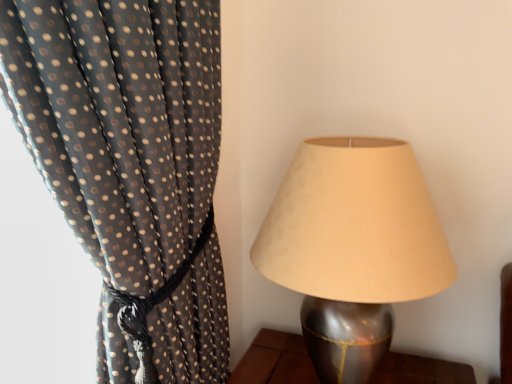
Find the location of `black sheer fabric with gold dots at left`. black sheer fabric with gold dots at left is located at coordinates (119, 134).

What do you see at coordinates (119, 134) in the screenshot? I see `black sheer fabric with gold dots at left` at bounding box center [119, 134].

Describe the element at coordinates (353, 247) in the screenshot. I see `metallic silver lampshade at right` at that location.

Locate an element on the screen. This screenshot has height=384, width=512. metallic silver lampshade at right is located at coordinates click(x=353, y=247).

Where is `black sheer fabric with gold dots at left`? black sheer fabric with gold dots at left is located at coordinates (119, 134).

Is black sheer fabric with gold dots at left to the right of metallic silver lampshade at right from the viewer's perspective?

Incorrect, black sheer fabric with gold dots at left is not on the right side of metallic silver lampshade at right.

Which object is closer to the camera, black sheer fabric with gold dots at left or metallic silver lampshade at right?

black sheer fabric with gold dots at left is more forward.

Looking at this image, which point is more forward, (67, 99) or (283, 262)?

The point (67, 99) is closer.

From the image's perspective, does black sheer fabric with gold dots at left appear higher than metallic silver lampshade at right?

Yes, from the image's perspective, black sheer fabric with gold dots at left is on top of metallic silver lampshade at right.

From a real-world perspective, is black sheer fabric with gold dots at left on metallic silver lampshade at right?

Indeed, from a real-world perspective, black sheer fabric with gold dots at left stands above metallic silver lampshade at right.

Based on the photo, which of these two, black sheer fabric with gold dots at left or metallic silver lampshade at right, is thinner?

metallic silver lampshade at right is thinner.

Which of these two, black sheer fabric with gold dots at left or metallic silver lampshade at right, stands taller?

Standing taller between the two is black sheer fabric with gold dots at left.

Which of these two, black sheer fabric with gold dots at left or metallic silver lampshade at right, is smaller?

metallic silver lampshade at right is smaller.

Which is correct: black sheer fabric with gold dots at left is inside metallic silver lampshade at right, or outside of it?

black sheer fabric with gold dots at left is located beyond the bounds of metallic silver lampshade at right.

Is black sheer fabric with gold dots at left not near metallic silver lampshade at right?

black sheer fabric with gold dots at left is near metallic silver lampshade at right, not far away.

Is black sheer fabric with gold dots at left looking in the opposite direction of metallic silver lampshade at right?

No, black sheer fabric with gold dots at left is not facing the opposite direction of metallic silver lampshade at right.

How different are the orientations of black sheer fabric with gold dots at left and metallic silver lampshade at right in degrees?

There is a 8.63e-05-degree angle between the facing directions of black sheer fabric with gold dots at left and metallic silver lampshade at right.

How much distance is there between black sheer fabric with gold dots at left and metallic silver lampshade at right?

They are 11.75 inches apart.

This screenshot has width=512, height=384. What are the coordinates of `lamp on the right of black sheer fabric with gold dots at left` in the screenshot? It's located at (353, 247).

Is metallic silver lampshade at right at the right side of black sheer fabric with gold dots at left?

Indeed, metallic silver lampshade at right is positioned on the right side of black sheer fabric with gold dots at left.

Which object is closer to the camera taking this photo, metallic silver lampshade at right or black sheer fabric with gold dots at left?

black sheer fabric with gold dots at left is in front.

Is point (297, 195) closer or farther from the camera than point (103, 161)?

Point (297, 195).

From the image's perspective, would you say metallic silver lampshade at right is positioned over black sheer fabric with gold dots at left?

Incorrect, from the image's perspective, metallic silver lampshade at right is lower than black sheer fabric with gold dots at left.

From a real-world perspective, who is located lower, metallic silver lampshade at right or black sheer fabric with gold dots at left?

metallic silver lampshade at right.

Which object is wider, metallic silver lampshade at right or black sheer fabric with gold dots at left?

Wider between the two is black sheer fabric with gold dots at left.

Considering the relative sizes of metallic silver lampshade at right and black sheer fabric with gold dots at left in the image provided, is metallic silver lampshade at right shorter than black sheer fabric with gold dots at left?

A: Correct, metallic silver lampshade at right is not as tall as black sheer fabric with gold dots at left.

Can you confirm if metallic silver lampshade at right is smaller than black sheer fabric with gold dots at left?

Indeed, metallic silver lampshade at right has a smaller size compared to black sheer fabric with gold dots at left.

Can we say metallic silver lampshade at right lies outside black sheer fabric with gold dots at left?

That's correct, metallic silver lampshade at right is outside of black sheer fabric with gold dots at left.

Is metallic silver lampshade at right directly adjacent to black sheer fabric with gold dots at left?

metallic silver lampshade at right and black sheer fabric with gold dots at left are not in contact.

Is metallic silver lampshade at right oriented towards black sheer fabric with gold dots at left?

No, metallic silver lampshade at right is not facing towards black sheer fabric with gold dots at left.

In the image, there is a black sheer fabric with gold dots at left. Find the location of `lamp below it (from a real-world perspective)`. lamp below it (from a real-world perspective) is located at coordinates (353, 247).

Image resolution: width=512 pixels, height=384 pixels. What are the coordinates of `lamp behind the black sheer fabric with gold dots at left` in the screenshot? It's located at (353, 247).

Locate an element on the screen. The height and width of the screenshot is (384, 512). curtain above the metallic silver lampshade at right (from the image's perspective) is located at coordinates click(x=119, y=134).